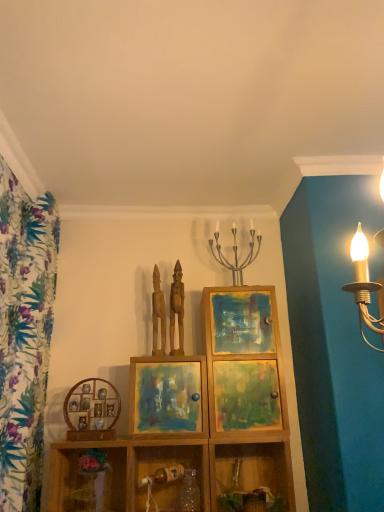
This screenshot has width=384, height=512. Describe the element at coordinates (158, 314) in the screenshot. I see `wooden statue at center, placed as the second sculpture when sorted from right to left` at that location.

Locate an element on the screen. wooden statue at center, which appears as the 1th sculpture when viewed from the right is located at coordinates [177, 309].

What do you see at coordinates (244, 360) in the screenshot? Image resolution: width=384 pixels, height=512 pixels. I see `wooden cabinet at center` at bounding box center [244, 360].

Image resolution: width=384 pixels, height=512 pixels. In order to click on metallic candle holder at center in this screenshot , I will do `click(235, 254)`.

What is the approximate width of wooden shelf at lower left, which is the 1th shelf from left to right?

wooden shelf at lower left, which is the 1th shelf from left to right, is 6.43 inches wide.

In the scene shown: In order to face wooden at center, acting as the 3th shelf starting from the right, should I rotate leftwards or rightwards?

You should rotate left by 7.964 degrees.

You are a GUI agent. You are given a task and a screenshot of the screen. Output one action in this format:
    pyautogui.click(x=<x>, y=<y>)
    Task: Click on the wooden shelf at lower center, which appears as the third shelf when viewed from the left
    
    Given the screenshot: What is the action you would take?
    (x=164, y=466)

Image resolution: width=384 pixels, height=512 pixels. What are the coordinates of `wooden statue at center, acting as the first sculpture starting from the left` in the screenshot? It's located at (158, 314).

From a real-world perspective, who is located higher, wooden shelf at lower left, which is the 1th shelf from left to right, or wooden at center, acting as the 3th shelf starting from the right?

In real-world perspective, wooden shelf at lower left, which is the 1th shelf from left to right, is above.

Which object is thinner, wooden shelf at lower left, the fourth shelf in the right-to-left sequence, or wooden at center, positioned as the second shelf in left-to-right order?

With smaller width is wooden shelf at lower left, the fourth shelf in the right-to-left sequence.

The image size is (384, 512). What are the coordinates of `the 2nd shelf behind when counting from the wooden at center, positioned as the second shelf in left-to-right order` in the screenshot? It's located at (88, 476).

Looking at this image, considering the relative sizes of wooden shelf at lower left, the fourth shelf in the right-to-left sequence, and wooden at center, positioned as the second shelf in left-to-right order, in the image provided, is wooden shelf at lower left, the fourth shelf in the right-to-left sequence, bigger than wooden at center, positioned as the second shelf in left-to-right order,?

No.

Considering the relative sizes of wooden statue at center, placed as the second sculpture when sorted from right to left, and wooden shelf at lower right, which is the fourth shelf in left-to-right order, in the image provided, is wooden statue at center, placed as the second sculpture when sorted from right to left, bigger than wooden shelf at lower right, which is the fourth shelf in left-to-right order,?

Actually, wooden statue at center, placed as the second sculpture when sorted from right to left, might be smaller than wooden shelf at lower right, which is the fourth shelf in left-to-right order.

Which is more to the right, wooden statue at center, acting as the first sculpture starting from the left, or wooden shelf at lower right, which is the first shelf from right to left?

wooden shelf at lower right, which is the first shelf from right to left.

Considering their positions, is wooden statue at center, placed as the second sculpture when sorted from right to left, located in front of or behind wooden shelf at lower right, which is the first shelf from right to left?

Visually, wooden statue at center, placed as the second sculpture when sorted from right to left, is located behind wooden shelf at lower right, which is the first shelf from right to left.

From the image's perspective, is wooden statue at center, placed as the second sculpture when sorted from right to left, on wooden shelf at lower right, which is the first shelf from right to left?

Yes.

Considering the sizes of objects wooden shelf at lower left, the fourth shelf in the right-to-left sequence, and matte wooden picture frame at center, arranged as the 1th picture frame when viewed from the right, in the image provided, who is taller, wooden shelf at lower left, the fourth shelf in the right-to-left sequence, or matte wooden picture frame at center, arranged as the 1th picture frame when viewed from the right,?

Standing taller between the two is matte wooden picture frame at center, arranged as the 1th picture frame when viewed from the right.

Is matte wooden picture frame at center, arranged as the 1th picture frame when viewed from the right, completely or partially inside wooden shelf at lower left, which is the 1th shelf from left to right?

No, matte wooden picture frame at center, arranged as the 1th picture frame when viewed from the right, is not surrounded by wooden shelf at lower left, which is the 1th shelf from left to right.

Does wooden shelf at lower left, which is the 1th shelf from left to right, have a smaller size compared to matte wooden picture frame at center, the second picture frame when ordered from left to right?

Correct, wooden shelf at lower left, which is the 1th shelf from left to right, occupies less space than matte wooden picture frame at center, the second picture frame when ordered from left to right.

From the image's perspective, is wooden shelf at lower left, the fourth shelf in the right-to-left sequence, above or below matte wooden picture frame at center, the second picture frame when ordered from left to right?

wooden shelf at lower left, the fourth shelf in the right-to-left sequence, is situated lower than matte wooden picture frame at center, the second picture frame when ordered from left to right, in the image.

Which of these two, matte wooden picture frame at center, arranged as the 1th picture frame when viewed from the right, or metallic candle holder at center, is bigger?

Bigger between the two is matte wooden picture frame at center, arranged as the 1th picture frame when viewed from the right.

Considering the positions of points (131, 391) and (227, 266), is point (131, 391) closer to camera compared to point (227, 266)?

That is True.

Which of these two, matte wooden picture frame at center, arranged as the 1th picture frame when viewed from the right, or metallic candle holder at center, stands shorter?

matte wooden picture frame at center, arranged as the 1th picture frame when viewed from the right.

Which object is further away from the camera, wooden cabinet at center or metallic candle holder at center?

metallic candle holder at center is more distant.

Considering the positions of objects wooden cabinet at center and metallic candle holder at center in the image provided, who is more to the right, wooden cabinet at center or metallic candle holder at center?

wooden cabinet at center is more to the right.

From a real-world perspective, who is located higher, wooden cabinet at center or metallic candle holder at center?

metallic candle holder at center.

Considering the positions of point (219, 471) and point (139, 504), is point (219, 471) closer or farther from the camera than point (139, 504)?

Point (219, 471) appears to be closer to the viewer than point (139, 504).

Which object is thinner, wooden shelf at lower right, which is the fourth shelf in left-to-right order, or wooden shelf at lower center, which ranks as the second shelf in right-to-left order?

wooden shelf at lower center, which ranks as the second shelf in right-to-left order.

From a real-world perspective, between wooden shelf at lower right, which is the first shelf from right to left, and wooden shelf at lower center, which ranks as the second shelf in right-to-left order, who is vertically lower?

wooden shelf at lower center, which ranks as the second shelf in right-to-left order.

Is wooden cabinet at center positioned behind wooden shelf at lower center, which ranks as the second shelf in right-to-left order?

Yes, wooden cabinet at center is behind wooden shelf at lower center, which ranks as the second shelf in right-to-left order.

Considering the points (272, 383) and (157, 466), which point is in front, point (272, 383) or point (157, 466)?

The point (272, 383) is in front.

Are wooden cabinet at center and wooden shelf at lower center, which ranks as the second shelf in right-to-left order, far apart?

That's not correct — wooden cabinet at center is a little close to wooden shelf at lower center, which ranks as the second shelf in right-to-left order.

Is wooden cabinet at center taller than wooden shelf at lower center, which appears as the third shelf when viewed from the left?

Yes.

You are a GUI agent. You are given a task and a screenshot of the screen. Output one action in this format:
    pyautogui.click(x=<x>, y=<y>)
    Task: Click on the 2nd shelf in front of the wooden shelf at lower left, the fourth shelf in the right-to-left sequence
    This screenshot has height=512, width=384.
    Given the screenshot: What is the action you would take?
    pyautogui.click(x=167, y=465)

You are a GUI agent. You are given a task and a screenshot of the screen. Output one action in this format:
    pyautogui.click(x=<x>, y=<y>)
    Task: Click on the 2nd shelf counting from the right side of the wooden statue at center, placed as the second sculpture when sorted from right to left
    Image resolution: width=384 pixels, height=512 pixels.
    Given the screenshot: What is the action you would take?
    pyautogui.click(x=251, y=470)

Looking at this image, considering their positions, is matte wooden picture frame at center, the second picture frame when ordered from left to right, positioned further to wooden shelf at lower left, which is the 1th shelf from left to right, than wooden shelf at lower center, which appears as the third shelf when viewed from the left?

matte wooden picture frame at center, the second picture frame when ordered from left to right, is further to wooden shelf at lower left, which is the 1th shelf from left to right.

From the image, which object appears to be farther from matte wooden picture frame at center, the second picture frame when ordered from left to right, wooden shelf at lower left, the fourth shelf in the right-to-left sequence, or wooden cabinet at center?

Among the two, wooden shelf at lower left, the fourth shelf in the right-to-left sequence, is located further to matte wooden picture frame at center, the second picture frame when ordered from left to right.

Considering their positions, is wooden statue at center, which appears as the 1th sculpture when viewed from the right, positioned closer to wooden at center, positioned as the second shelf in left-to-right order, than wooden picture frame at center-left, positioned as the first picture frame in left-to-right order?

wooden picture frame at center-left, positioned as the first picture frame in left-to-right order.

Considering their positions, is wooden statue at center, the 2th sculpture when ordered from left to right, positioned further to wooden statue at center, placed as the second sculpture when sorted from right to left, than wooden picture frame at center-left, positioned as the first picture frame in left-to-right order?

wooden picture frame at center-left, positioned as the first picture frame in left-to-right order, is positioned further to the anchor wooden statue at center, placed as the second sculpture when sorted from right to left.

From the picture: From the image, which object appears to be farther from matte wooden picture frame at center, arranged as the 1th picture frame when viewed from the right, wooden cabinet at center or wooden picture frame at center-left, the 2th picture frame viewed from the right?

Result: wooden picture frame at center-left, the 2th picture frame viewed from the right, lies further to matte wooden picture frame at center, arranged as the 1th picture frame when viewed from the right, than the other object.

From the image, which object appears to be nearer to wooden statue at center, placed as the second sculpture when sorted from right to left, matte wooden picture frame at center, the second picture frame when ordered from left to right, or wooden statue at center, which appears as the 1th sculpture when viewed from the right?

wooden statue at center, which appears as the 1th sculpture when viewed from the right, is closer to wooden statue at center, placed as the second sculpture when sorted from right to left.

From the image, which object appears to be nearer to wooden statue at center, which appears as the 1th sculpture when viewed from the right, wooden shelf at lower center, which ranks as the second shelf in right-to-left order, or wooden picture frame at center-left, positioned as the first picture frame in left-to-right order?

wooden picture frame at center-left, positioned as the first picture frame in left-to-right order, is closer to wooden statue at center, which appears as the 1th sculpture when viewed from the right.

Looking at the image, which one is located further to wooden statue at center, placed as the second sculpture when sorted from right to left, wooden picture frame at center-left, positioned as the first picture frame in left-to-right order, or wooden shelf at lower right, which is the fourth shelf in left-to-right order?

Based on the image, wooden shelf at lower right, which is the fourth shelf in left-to-right order, appears to be further to wooden statue at center, placed as the second sculpture when sorted from right to left.

Where is `cabinet between wooden statue at center, which appears as the 1th sculpture when viewed from the right, and wooden shelf at lower center, which ranks as the second shelf in right-to-left order, vertically`? cabinet between wooden statue at center, which appears as the 1th sculpture when viewed from the right, and wooden shelf at lower center, which ranks as the second shelf in right-to-left order, vertically is located at coordinates (244, 360).

Where is `cabinet between metallic candle holder at center and wooden shelf at lower left, which is the 1th shelf from left to right, in the up-down direction`? The height and width of the screenshot is (512, 384). cabinet between metallic candle holder at center and wooden shelf at lower left, which is the 1th shelf from left to right, in the up-down direction is located at coordinates (244, 360).

This screenshot has width=384, height=512. Identify the location of picture frame between wooden picture frame at center-left, the 2th picture frame viewed from the right, and wooden shelf at lower right, which is the first shelf from right to left. (167, 395).

The image size is (384, 512). I want to click on cabinet between wooden statue at center, acting as the first sculpture starting from the left, and wooden at center, acting as the 3th shelf starting from the right, in the up-down direction, so click(x=244, y=360).